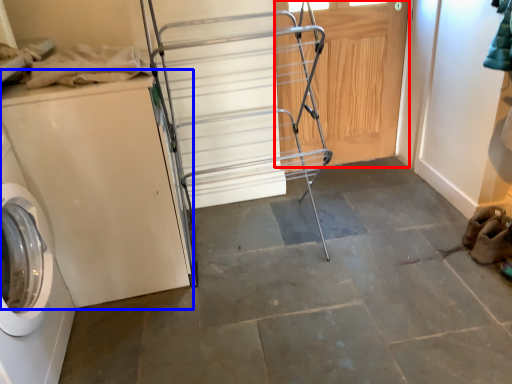
Question: Which object is further to the camera taking this photo, door (highlighted by a red box) or washing machine (highlighted by a blue box)?

Choices:
 (A) door
 (B) washing machine

Answer: (A)